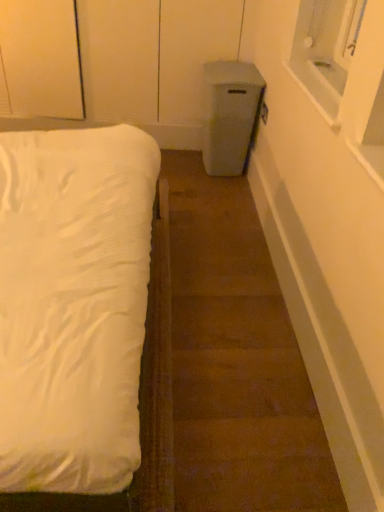
Question: Looking at the image, does brown carpet at lower left seem bigger or smaller compared to white soft bed at left?

Choices:
 (A) big
 (B) small

Answer: (B)

Question: Is brown carpet at lower left situated inside white soft bed at left or outside?

Choices:
 (A) outside
 (B) inside

Answer: (A)

Question: Based on their positions, is brown carpet at lower left located to the left or right of white soft bed at left?

Choices:
 (A) left
 (B) right

Answer: (B)

Question: Looking at the image, does white soft bed at left seem bigger or smaller compared to brown carpet at lower left?

Choices:
 (A) small
 (B) big

Answer: (B)

Question: Is white soft bed at left wider or thinner than brown carpet at lower left?

Choices:
 (A) thin
 (B) wide

Answer: (B)

Question: Considering their positions, is white soft bed at left located in front of or behind brown carpet at lower left?

Choices:
 (A) front
 (B) behind

Answer: (A)

Question: In the image, is white soft bed at left on the left side or the right side of brown carpet at lower left?

Choices:
 (A) right
 (B) left

Answer: (B)